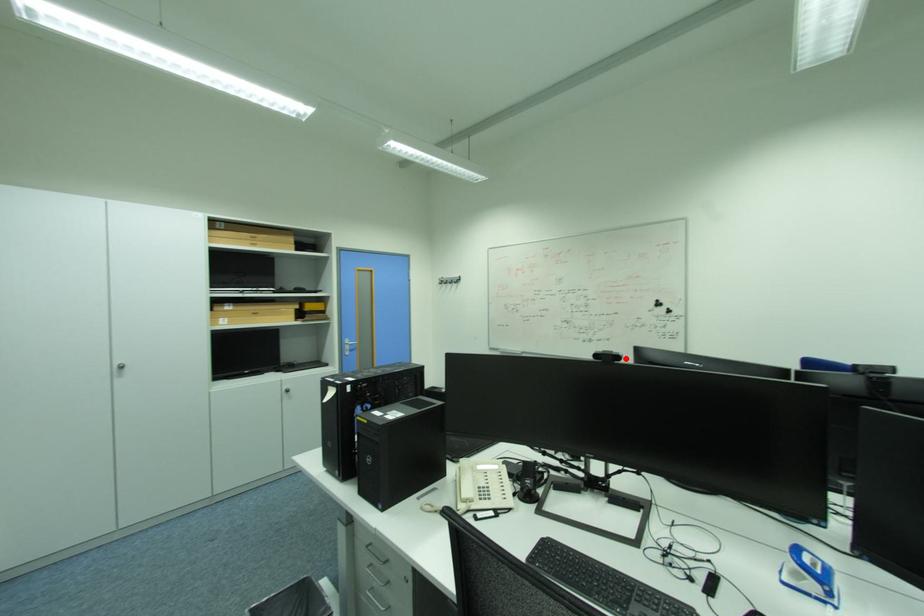
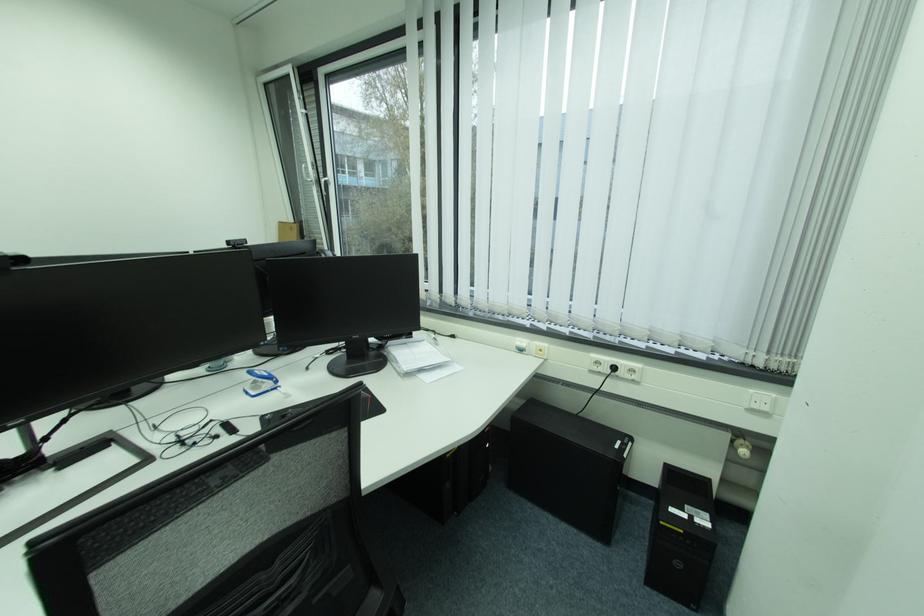
Find the pixel in the second image that matches the highlighted location in the first image.

(29, 261)